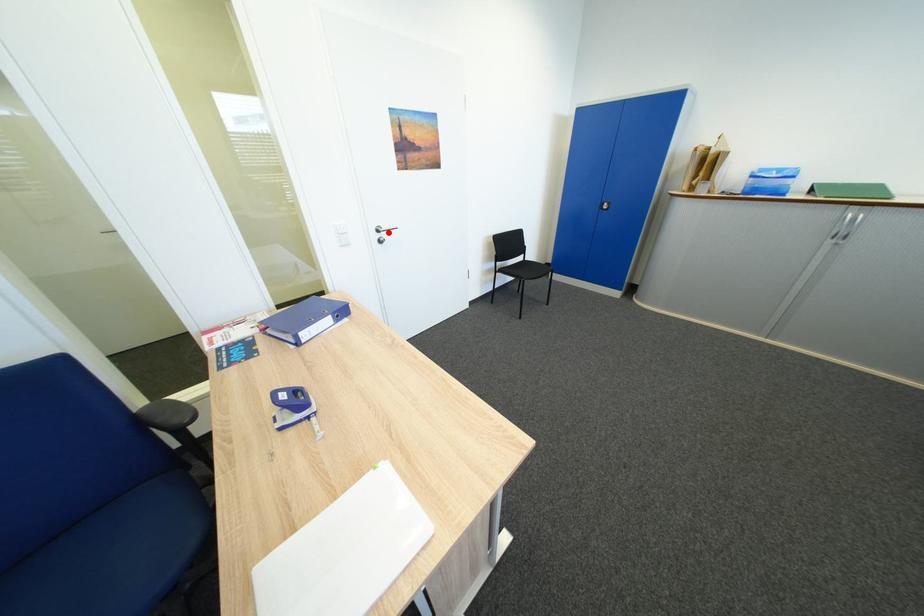
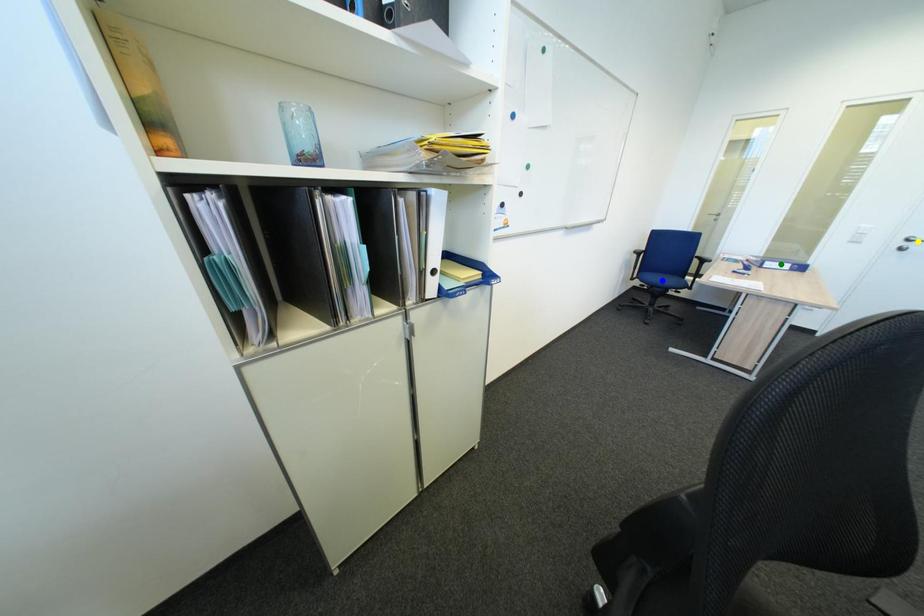
Question: I am providing you with two images of the same scene from different viewpoints. A red point is marked on the first image. You are given multiple points on the second image. Can you choose the point in image 2 that corresponds to the point in image 1?

Choices:
 (A) blue point
 (B) yellow point
 (C) green point

Answer: (B)